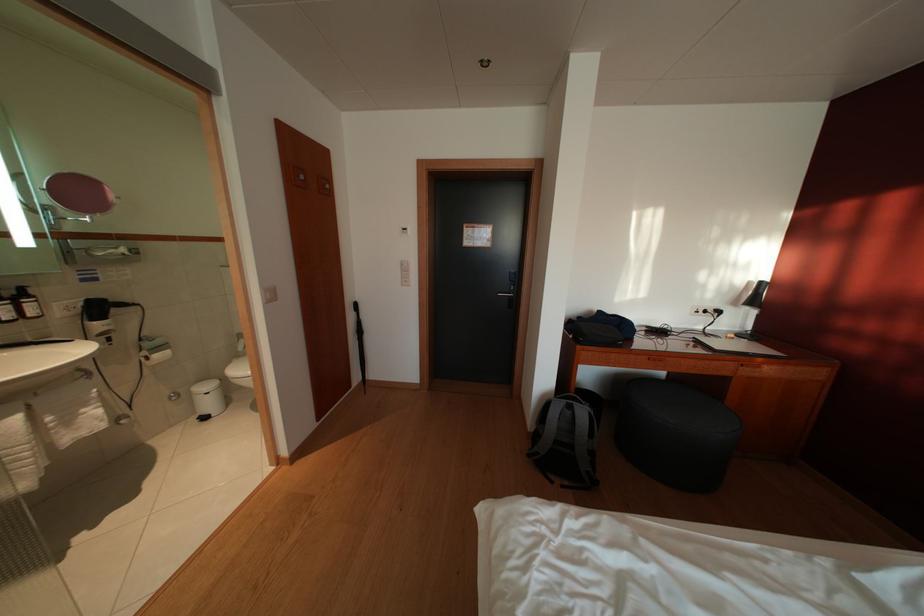
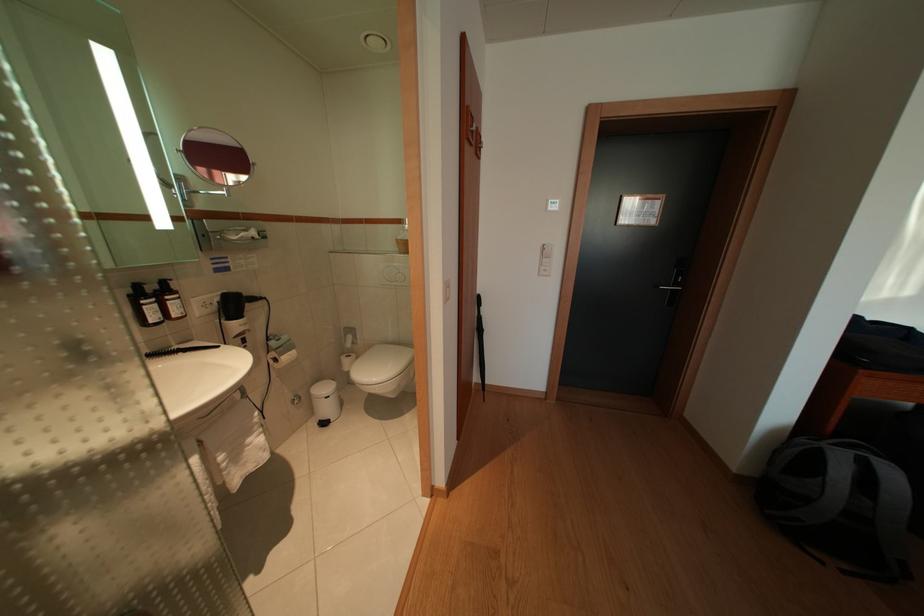
Where in the second image is the point corresponding to (107,315) from the first image?

(242, 310)